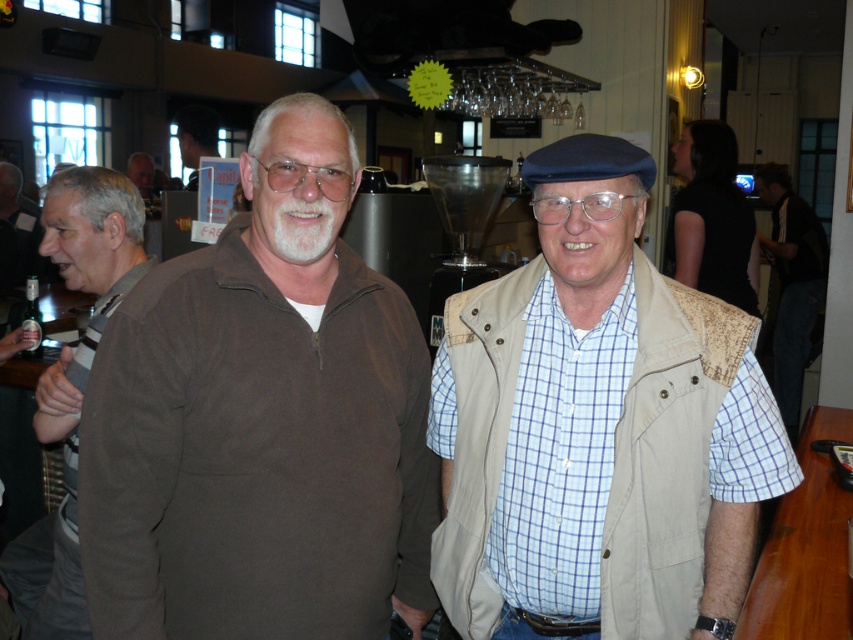
Question: Observing the image, what is the correct spatial positioning of brown suede sweater at center in reference to blue checkered shirt at right?

Choices:
 (A) right
 (B) left

Answer: (B)

Question: Observing the image, what is the correct spatial positioning of blue checkered shirt at right in reference to matte black jacket at upper left?

Choices:
 (A) above
 (B) below

Answer: (B)

Question: Which object appears closest to the camera in this image?

Choices:
 (A) matte brown jacket at left
 (B) brown cotton sweater at left
 (C) brown suede sweater at center

Answer: (C)

Question: Which point is farther to the camera?

Choices:
 (A) matte black jacket at upper left
 (B) matte black hair at upper left

Answer: (B)

Question: Does beige textured vest at center have a greater width compared to matte black hair at upper left?

Choices:
 (A) yes
 (B) no

Answer: (B)

Question: Among these objects, which one is farthest from the camera?

Choices:
 (A) beige textured vest at center
 (B) blue checkered shirt at right
 (C) brown suede sweater at center
 (D) matte black jacket at upper left

Answer: (B)